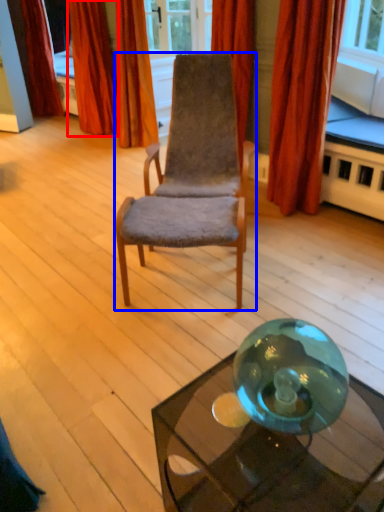
Question: Among these objects, which one is nearest to the camera, curtain (highlighted by a red box) or chair (highlighted by a blue box)?

Choices:
 (A) curtain
 (B) chair

Answer: (B)